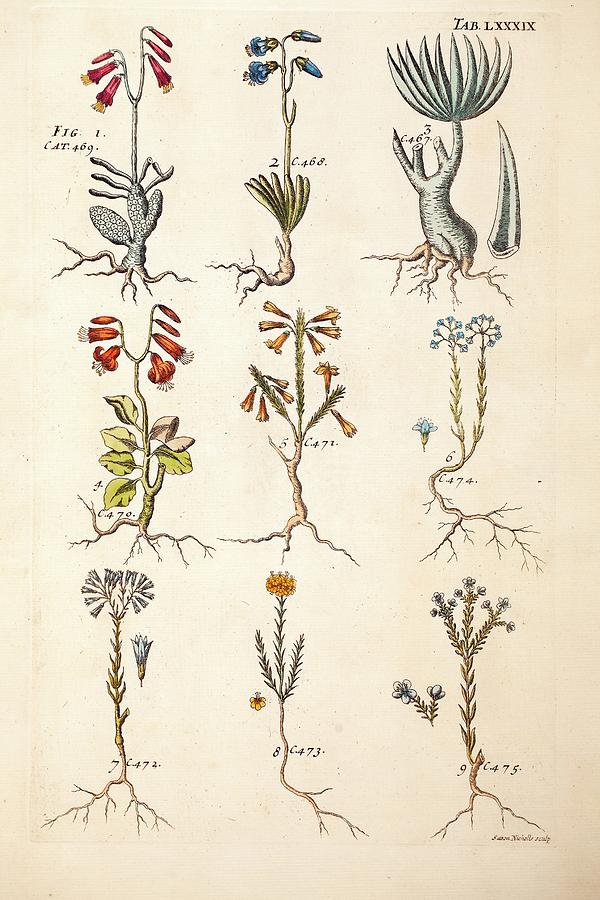
Where is `empty space right of flowers`? The image size is (600, 900). empty space right of flowers is located at coordinates (574, 423).